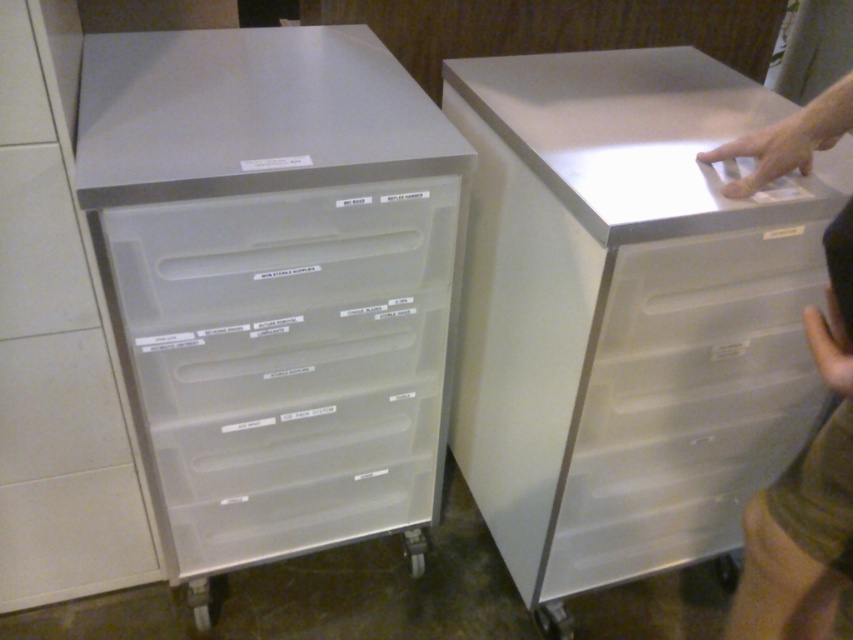
Is point (279, 257) less distant than point (834, 522)?

That is False.

Looking at this image, which of these two, clear plastic drawers at left or skinny jeans at right, stands shorter?

With less height is skinny jeans at right.

Measure the distance between clear plastic drawers at left and camera.

clear plastic drawers at left and camera are 33.16 inches apart.

At what (x,y) coordinates should I click in order to perform the action: click on clear plastic drawers at left. Please return your answer as a coordinate pair (x, y). The height and width of the screenshot is (640, 853). Looking at the image, I should click on (276, 280).

Does clear plastic drawers at left have a greater width compared to satin silver drawer at upper center?

In fact, clear plastic drawers at left might be narrower than satin silver drawer at upper center.

Is point (97, 74) farther from camera compared to point (689, 509)?

That is False.

Identify the location of clear plastic drawers at left. This screenshot has height=640, width=853. (276, 280).

Between satin silver drawer at upper center and skinny jeans at right, which one is positioned lower?

Positioned lower is skinny jeans at right.

Which is behind, point (701, 204) or point (827, 563)?

The point (701, 204) is more distant.

This screenshot has height=640, width=853. What are the coordinates of `satin silver drawer at upper center` in the screenshot? It's located at (627, 312).